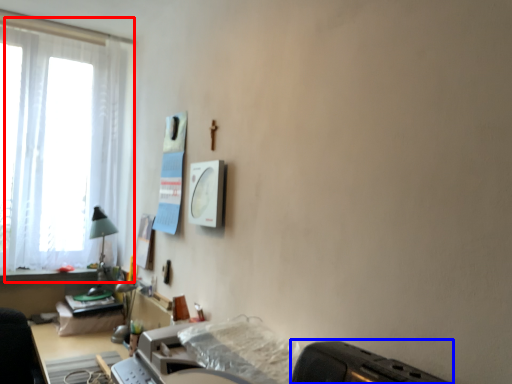
Question: Which object is closer to the camera taking this photo, window (highlighted by a red box) or appliance (highlighted by a blue box)?

Choices:
 (A) window
 (B) appliance

Answer: (B)